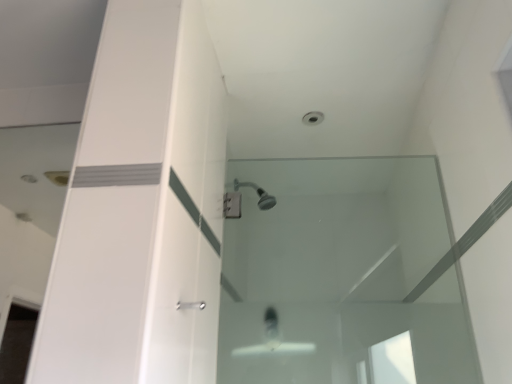
Describe the element at coordinates (341, 275) in the screenshot. Image resolution: width=512 pixels, height=384 pixels. I see `transparent glass shower at center` at that location.

This screenshot has width=512, height=384. Find the location of `transparent glass shower at center`. transparent glass shower at center is located at coordinates (341, 275).

The width and height of the screenshot is (512, 384). I want to click on transparent glass shower at center, so click(x=341, y=275).